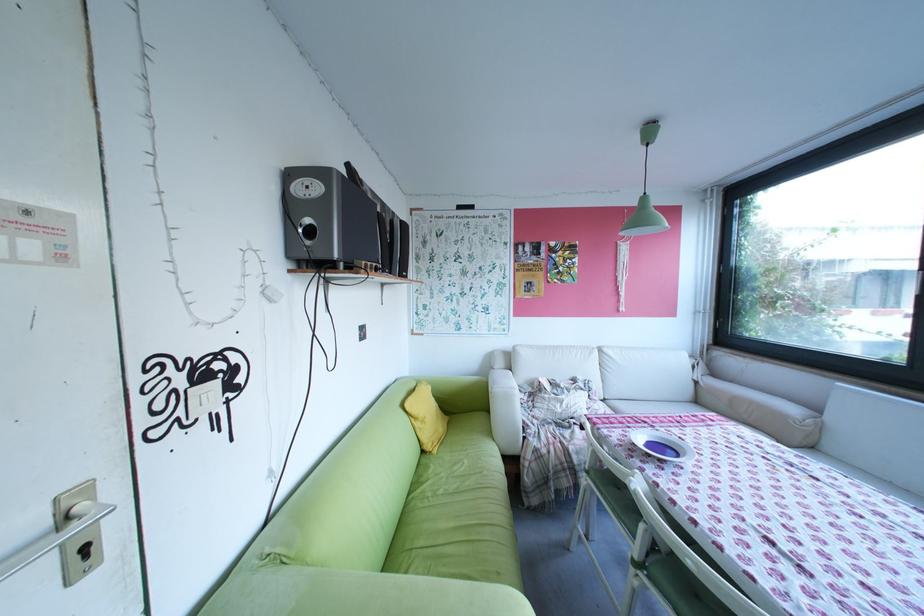
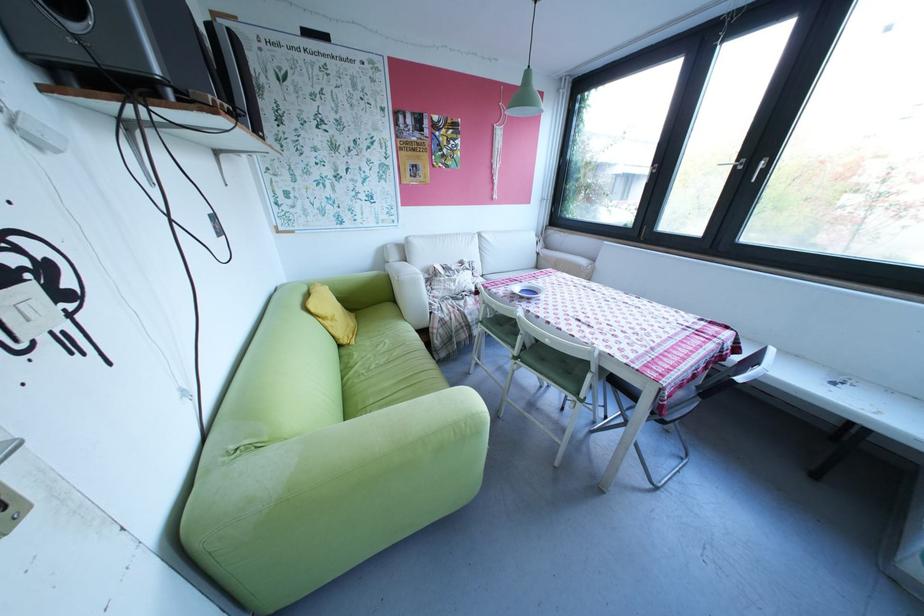
In the second image, find the point that corresponds to (447,451) in the first image.

(366, 342)